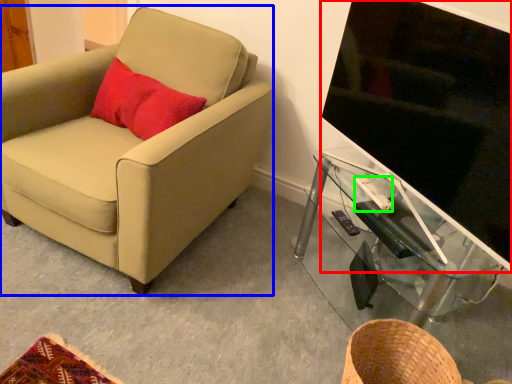
Question: Considering the real-world distances, which object is farthest from television (highlighted by a red box)? chair (highlighted by a blue box) or remote control (highlighted by a green box)?

Choices:
 (A) chair
 (B) remote control

Answer: (A)